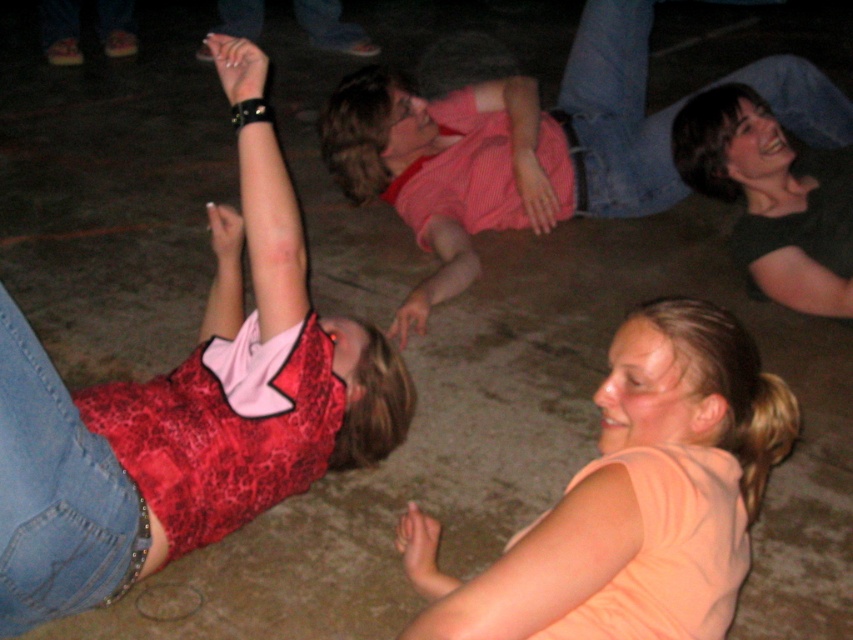
You are standing in the scene and want to hand a drink to both the red lace tank top at upper left and the orange fabric shirt at lower right. Which person should you approach first to ensure you can reach them without moving past the other?

You should approach the red lace tank top at upper left first because it is to the left of the orange fabric shirt at lower right, so you can reach them without needing to move past the other person.

You are organizing a clothing donation drive and need to sort items by size. You have an orange fabric shirt at lower right and a pink lace shirt at center. Which shirt should you place in the small size bin?

The orange fabric shirt at lower right is smaller than the pink lace shirt at center, so it should be placed in the small size bin.

You are a photographer trying to capture a group photo of the red lace tank top at upper left and the pink lace shirt at center. Based on their positions, which person should you ask to move slightly to the right to center them both in the frame?

The red lace tank top at upper left should move to the right since it is positioned on the left side of the pink lace shirt at center, so moving it right would help center both in the frame.